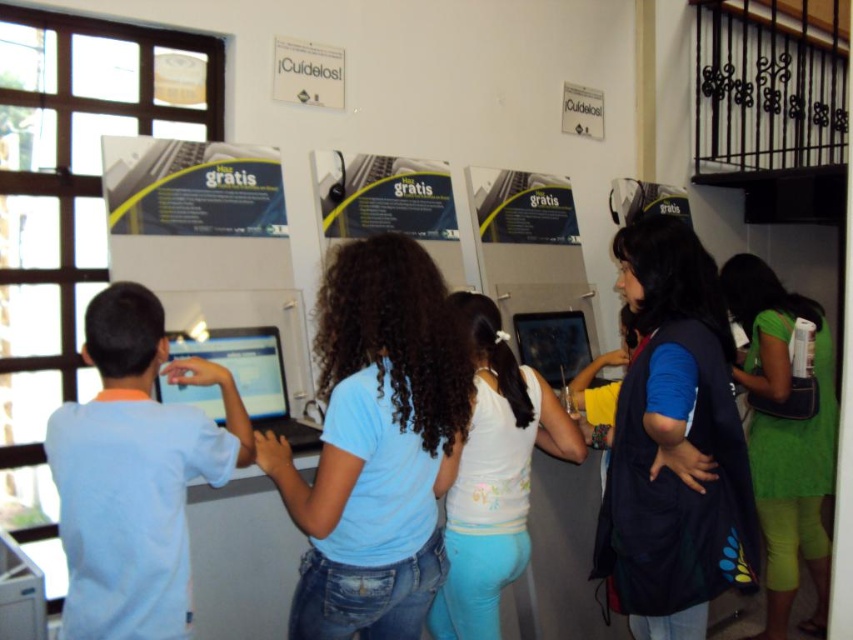
Question: Can you confirm if blue cotton shirt at center is positioned above green fabric dress at right?

Choices:
 (A) yes
 (B) no

Answer: (A)

Question: Where is blue cotton shirt at center located in relation to green fabric dress at right in the image?

Choices:
 (A) right
 (B) left

Answer: (B)

Question: Which of the following is the farthest from the observer?

Choices:
 (A) (502, 481)
 (B) (790, 374)
 (C) (659, 356)
 (D) (413, 477)

Answer: (B)

Question: Which of the following is the farthest from the observer?

Choices:
 (A) blue cotton shirt at center
 (B) dark blue fabric vest at center right
 (C) green fabric dress at right
 (D) white matte tank top at center

Answer: (C)

Question: Is blue cotton shirt at center to the right of white matte tank top at center from the viewer's perspective?

Choices:
 (A) no
 (B) yes

Answer: (A)

Question: Which point appears closest to the camera in this image?

Choices:
 (A) (776, 424)
 (B) (495, 484)

Answer: (B)